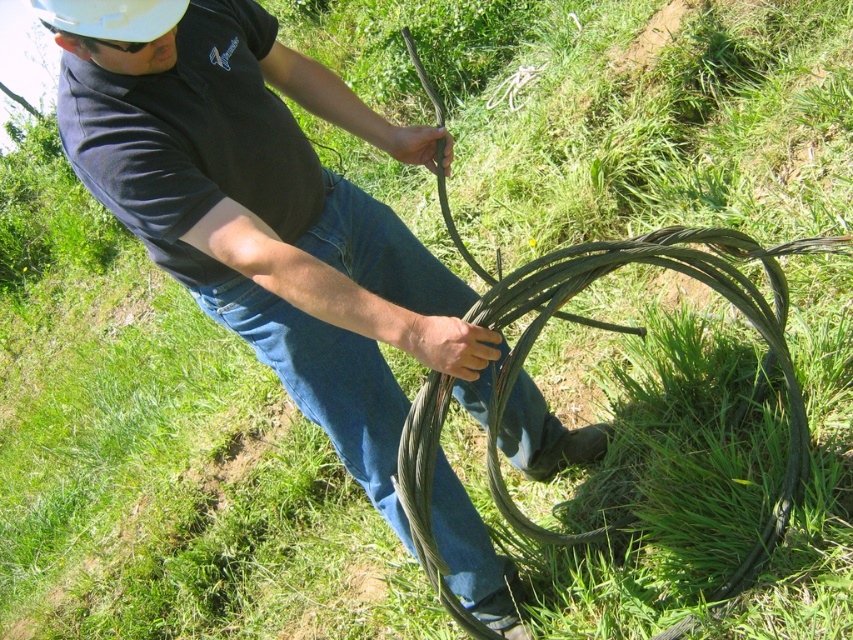
Is matte black cable at center positioned in front of blue denim jeans at center?

Yes, matte black cable at center is closer to the viewer.

Which is in front, point (316, 64) or point (334, 337)?

Positioned in front is point (334, 337).

Locate an element on the screen. matte black cable at center is located at coordinates (274, 220).

The height and width of the screenshot is (640, 853). What are the coordinates of `matte black cable at center` in the screenshot? It's located at (274, 220).

Does matte black cable at center have a smaller size compared to white matte hardhat at upper left?

No, matte black cable at center is not smaller than white matte hardhat at upper left.

How distant is matte black cable at center from white matte hardhat at upper left?

matte black cable at center is 25.12 inches from white matte hardhat at upper left.

Is point (171, 54) in front of point (155, 33)?

That is False.

The height and width of the screenshot is (640, 853). What are the coordinates of `matte black cable at center` in the screenshot? It's located at (274, 220).

Does point (445, 278) lie in front of point (51, 8)?

No, it is behind (51, 8).

Does blue denim jeans at center have a lesser width compared to white matte hardhat at upper left?

Incorrect, blue denim jeans at center's width is not less than white matte hardhat at upper left's.

Measure the distance between blue denim jeans at center and camera.

A distance of 1.97 meters exists between blue denim jeans at center and camera.

The height and width of the screenshot is (640, 853). I want to click on blue denim jeans at center, so click(323, 381).